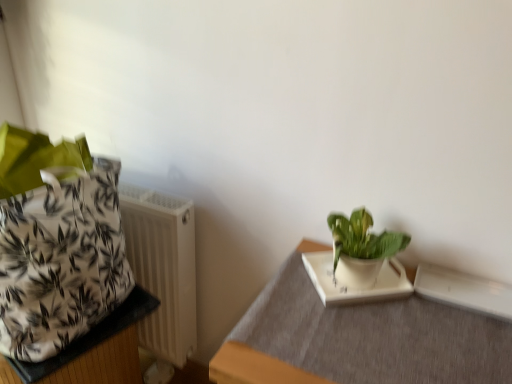
Consider the image. How much space does white matte tray at lower right, which is the second table in left-to-right order, occupy horizontally?

The width of white matte tray at lower right, which is the second table in left-to-right order, is 16.32 inches.

At what (x,y) coordinates should I click in order to perform the action: click on white fabric bag at left, which is the 2th table from right to left. Please return your answer as a coordinate pair (x, y). Image resolution: width=512 pixels, height=384 pixels. Looking at the image, I should click on (97, 347).

Identify the location of white matte flowerpot at left. (61, 263).

This screenshot has height=384, width=512. Describe the element at coordinates (61, 263) in the screenshot. I see `white matte flowerpot at left` at that location.

Identify the location of white matte tray at lower right, which is the second table in left-to-right order. This screenshot has height=384, width=512. (255, 368).

From a real-world perspective, between white matte flowerpot at left and white plastic radiator at left, who is vertically higher?

white matte flowerpot at left, from a real-world perspective.

Considering the sizes of objects white matte flowerpot at left and white plastic radiator at left in the image provided, who is thinner, white matte flowerpot at left or white plastic radiator at left?

Thinner between the two is white plastic radiator at left.

Based on the photo, is white matte flowerpot at left inside the boundaries of white plastic radiator at left, or outside?

white matte flowerpot at left is not enclosed by white plastic radiator at left.

Which is nearer, (101, 307) or (186, 356)?

Point (101, 307) is closer to the camera than point (186, 356).

From a real-world perspective, is white matte tray at lower right, which is the second table in left-to-right order, on white fabric bag at left, the 1th table from the left?

Yes, from a real-world perspective, white matte tray at lower right, which is the second table in left-to-right order, is above white fabric bag at left, the 1th table from the left.

Are white matte tray at lower right, which is the first table from right to left, and white fabric bag at left, which is the 2th table from right to left, located far from each other?

No, white matte tray at lower right, which is the first table from right to left, is not far away from white fabric bag at left, which is the 2th table from right to left.

Is white matte tray at lower right, which is the first table from right to left, in front of white fabric bag at left, the 1th table from the left?

Yes, it is.

Is white plastic radiator at left next to white matte tray at lower right, which is the second table in left-to-right order?

No.

Is white plastic radiator at left inside the boundaries of white matte tray at lower right, which is the first table from right to left, or outside?

The correct answer is: outside.

Between white plastic radiator at left and white matte tray at lower right, which is the second table in left-to-right order, which one has larger size?

white matte tray at lower right, which is the second table in left-to-right order, is bigger.

Is white plastic radiator at left oriented towards white matte tray at lower right, which is the second table in left-to-right order?

No, white plastic radiator at left is not oriented towards white matte tray at lower right, which is the second table in left-to-right order.

In the image, is white matte flowerpot at left positioned in front of or behind white fabric bag at left, the 1th table from the left?

In the image, white matte flowerpot at left appears in front of white fabric bag at left, the 1th table from the left.

Is the surface of white matte flowerpot at left in direct contact with white fabric bag at left, the 1th table from the left?

No, white matte flowerpot at left is not making contact with white fabric bag at left, the 1th table from the left.

From the image's perspective, which one is positioned higher, white matte flowerpot at left or white fabric bag at left, the 1th table from the left?

white matte flowerpot at left is shown above in the image.

Between point (1, 325) and point (110, 376), which one is positioned behind?

The point (110, 376) is behind.

From a real-world perspective, who is located lower, white matte tray at lower right, which is the second table in left-to-right order, or green glossy plant at upper right?

white matte tray at lower right, which is the second table in left-to-right order.

Is white matte tray at lower right, which is the first table from right to left, wider or thinner than green glossy plant at upper right?

Clearly, white matte tray at lower right, which is the first table from right to left, has more width compared to green glossy plant at upper right.

Which is less distant, (328, 382) or (358, 227)?

Point (328, 382) appears to be closer to the viewer than point (358, 227).

From the image's perspective, which one is positioned lower, white matte tray at lower right, which is the first table from right to left, or green glossy plant at upper right?

From the image's view, white matte tray at lower right, which is the first table from right to left, is below.

Does white fabric bag at left, the 1th table from the left, have a greater height compared to white plastic radiator at left?

No, white fabric bag at left, the 1th table from the left, is not taller than white plastic radiator at left.

Are white fabric bag at left, the 1th table from the left, and white plastic radiator at left beside each other?

No, white fabric bag at left, the 1th table from the left, is not making contact with white plastic radiator at left.

In terms of width, does white fabric bag at left, which is the 2th table from right to left, look wider or thinner when compared to white plastic radiator at left?

Clearly, white fabric bag at left, which is the 2th table from right to left, has more width compared to white plastic radiator at left.

From the image's perspective, which one is positioned lower, white matte flowerpot at left or green glossy plant at upper right?

green glossy plant at upper right.

In terms of height, does white matte flowerpot at left look taller or shorter compared to green glossy plant at upper right?

Considering their sizes, white matte flowerpot at left has more height than green glossy plant at upper right.

How many degrees apart are the facing directions of white matte flowerpot at left and green glossy plant at upper right?

The facing directions of white matte flowerpot at left and green glossy plant at upper right are 41 degrees apart.

Is point (106, 257) farther from viewer compared to point (394, 233)?

Yes, point (106, 257) is behind point (394, 233).

Find the location of a particular element. This screenshot has height=384, width=512. radiator behind the white matte flowerpot at left is located at coordinates pos(163,268).

At what (x,y) coordinates should I click in order to perform the action: click on table that appears below the white matte tray at lower right, which is the second table in left-to-right order (from a real-world perspective). Please return your answer as a coordinate pair (x, y). The width and height of the screenshot is (512, 384). Looking at the image, I should click on (97, 347).

In the scene shown: Looking at the image, which one is located further to white matte flowerpot at left, white plastic radiator at left or white matte tray at lower right, which is the second table in left-to-right order?

white matte tray at lower right, which is the second table in left-to-right order.

When comparing their distances from white matte flowerpot at left, does white plastic radiator at left or white fabric bag at left, the 1th table from the left, seem closer?

The object closer to white matte flowerpot at left is white fabric bag at left, the 1th table from the left.

Based on their spatial positions, is white fabric bag at left, which is the 2th table from right to left, or white plastic radiator at left further from white matte tray at lower right, which is the second table in left-to-right order?

Among the two, white plastic radiator at left is located further to white matte tray at lower right, which is the second table in left-to-right order.

Estimate the real-world distances between objects in this image. Which object is further from green glossy plant at upper right, white matte tray at lower right, which is the second table in left-to-right order, or white fabric bag at left, which is the 2th table from right to left?

white fabric bag at left, which is the 2th table from right to left, lies further to green glossy plant at upper right than the other object.

Considering their positions, is white plastic radiator at left positioned closer to green glossy plant at upper right than white matte flowerpot at left?

The object closer to green glossy plant at upper right is white plastic radiator at left.

From the image, which object appears to be farther from white fabric bag at left, the 1th table from the left, white plastic radiator at left or white matte tray at lower right, which is the first table from right to left?

white matte tray at lower right, which is the first table from right to left, is further to white fabric bag at left, the 1th table from the left.

Estimate the real-world distances between objects in this image. Which object is closer to white plastic radiator at left, white matte tray at lower right, which is the first table from right to left, or white fabric bag at left, which is the 2th table from right to left?

The object closer to white plastic radiator at left is white fabric bag at left, which is the 2th table from right to left.

From the image, which object appears to be farther from white matte tray at lower right, which is the first table from right to left, white matte flowerpot at left or white plastic radiator at left?

white plastic radiator at left is positioned further to the anchor white matte tray at lower right, which is the first table from right to left.

At what (x,y) coordinates should I click in order to perform the action: click on radiator between white matte flowerpot at left and white matte tray at lower right, which is the second table in left-to-right order, from left to right. Please return your answer as a coordinate pair (x, y). This screenshot has height=384, width=512. Looking at the image, I should click on (163, 268).

This screenshot has height=384, width=512. Identify the location of radiator located between white fabric bag at left, the 1th table from the left, and green glossy plant at upper right in the left-right direction. (163, 268).

Find the location of `houseplant between white fabric bag at left, which is the 2th table from right to left, and white matte tray at lower right, which is the first table from right to left, in the horizontal direction`. houseplant between white fabric bag at left, which is the 2th table from right to left, and white matte tray at lower right, which is the first table from right to left, in the horizontal direction is located at coordinates (361, 248).

I want to click on flowerpot situated between white fabric bag at left, which is the 2th table from right to left, and white matte tray at lower right, which is the second table in left-to-right order, from left to right, so click(61, 263).